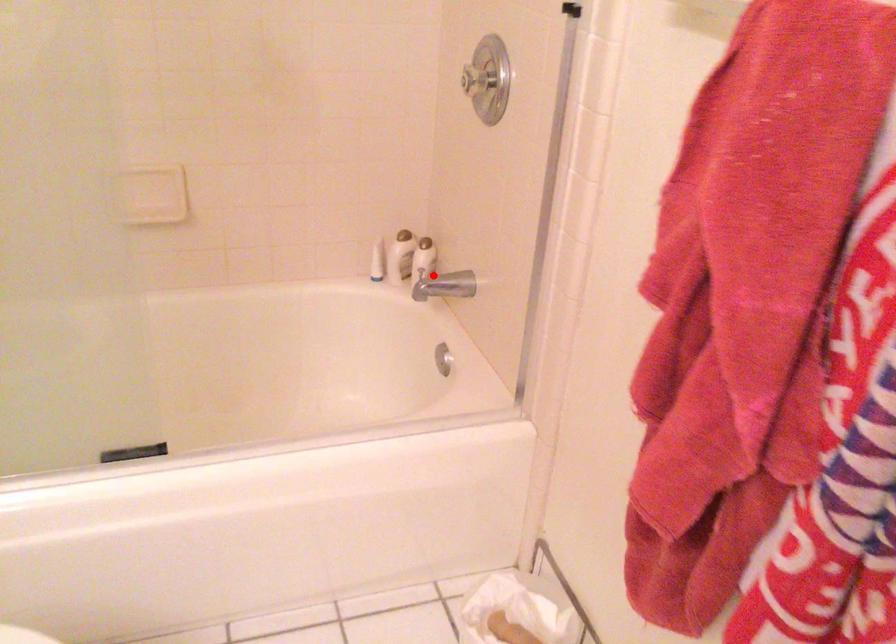
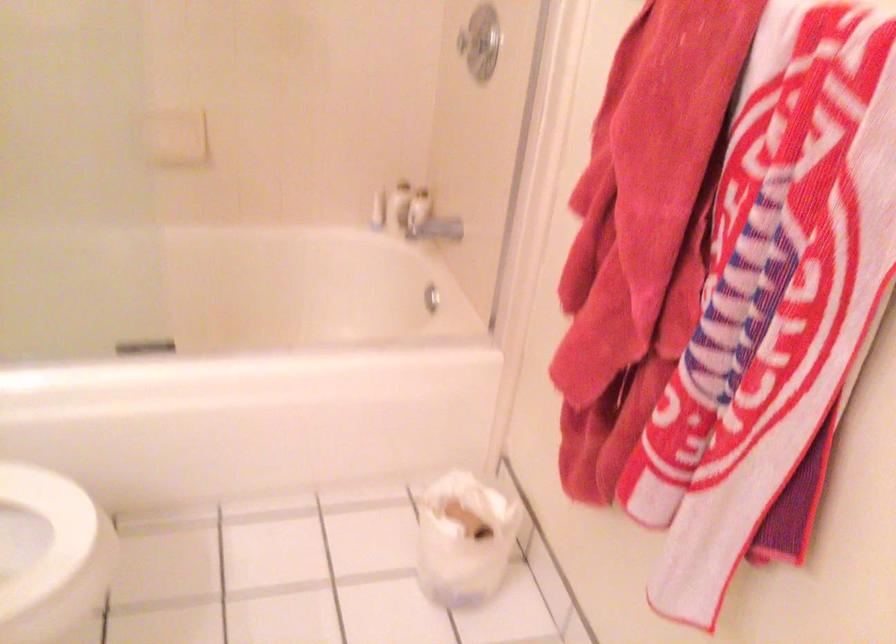
Locate, in the second image, the point that corresponds to the highlighted location in the first image.

(429, 221)